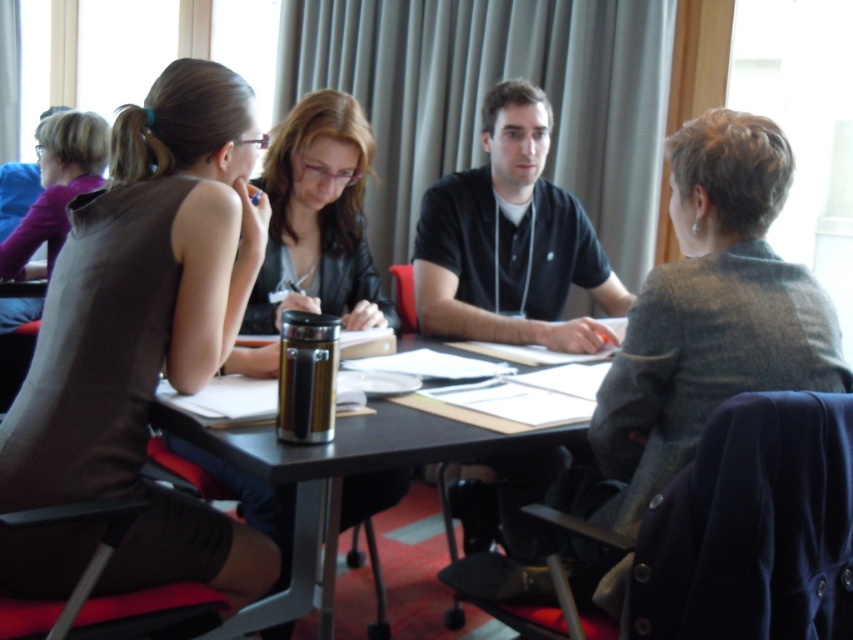
You are sitting at the rectangular table in the meeting. You need to pass a document to the person wearing the black cotton shirt at center. Which direction should you move the document from the matte brown shirt at upper left?

You should move the document to the right from the matte brown shirt at upper left to reach the black cotton shirt at center since the black cotton shirt at center is to the right of the matte brown shirt at upper left.

You are organizing a charity event and need to decide which clothing item to display first. Based on the scene, which item between the brown fabric dress at upper left and the matte brown shirt at upper left is bigger in size?

The brown fabric dress at upper left is larger in size compared to the matte brown shirt at upper left, so it should be displayed first.

You are a photographer setting up for a group photo. You need to position yourself so that both the brown fabric dress at upper left and the matte brown shirt at upper left are visible in your frame. Based on their positions, which object should be closer to the left edge of your camera viewfinder?

The matte brown shirt at upper left is to the left of the brown fabric dress at upper left, so the matte brown shirt at upper left will be closer to the left edge of the camera viewfinder.